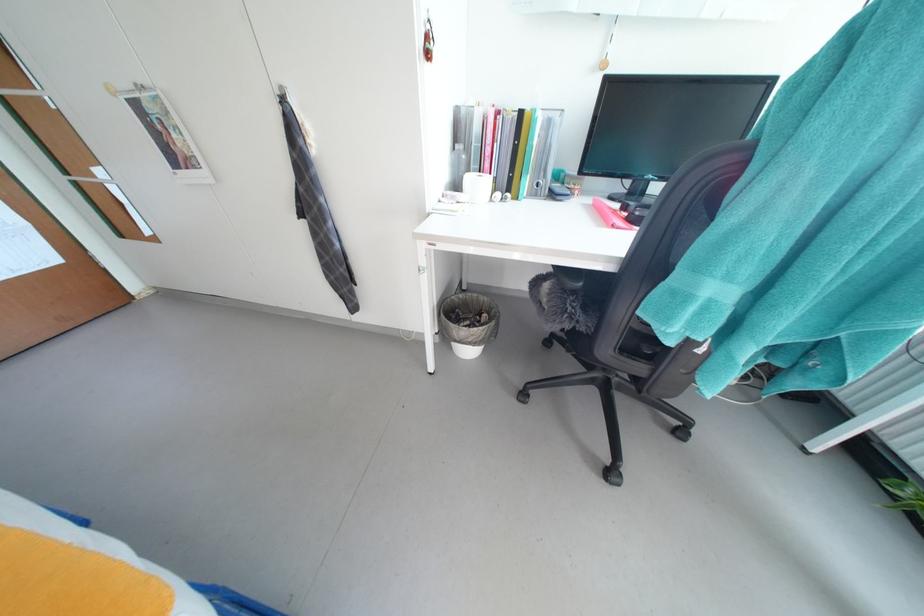
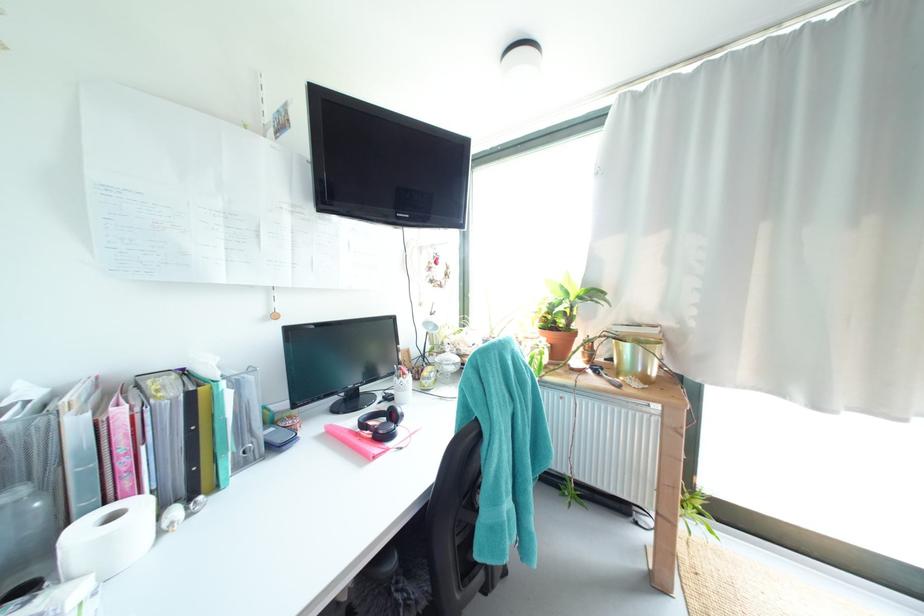
Locate, in the second image, the point that corresponds to (506,196) in the first image.

(185, 513)